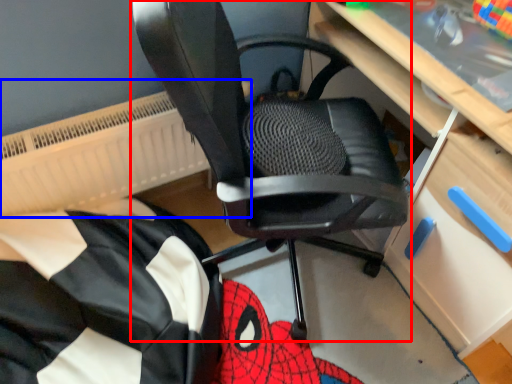
Question: Which of the following is the farthest to the observer, chair (highlighted by a red box) or radiator (highlighted by a blue box)?

Choices:
 (A) chair
 (B) radiator

Answer: (B)